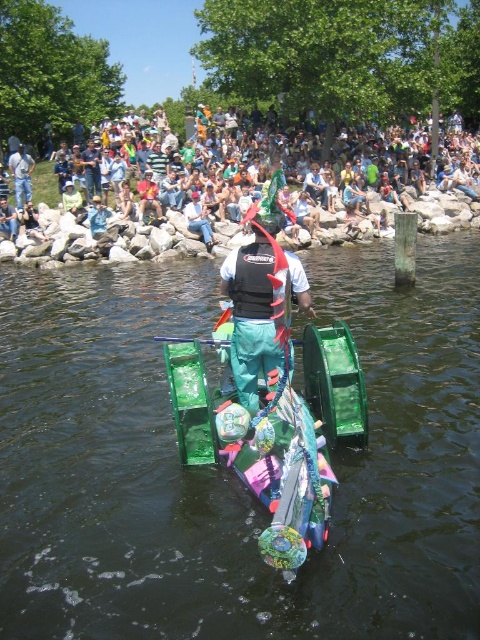
You are a photographer positioned at the center of the scene. You want to take a photo that includes both the point at coordinates point (312, 492) and point (26, 211). Which point should you focus on first to ensure both are in sharp focus?

To ensure both points are in sharp focus, you should focus on point (312, 492) first because it is closer to the viewer than point (26, 211). This way, the depth of field will cover both points more effectively.

You are a photographer trying to capture a photo of the shiny green plastic boat at center and the light blue fabric shirt at center. Which object should you focus on first if you want to ensure both are in the frame without moving the camera?

You should focus on the shiny green plastic boat at center first because it is positioned below the light blue fabric shirt at center, so adjusting focus starting from the lower object ensures both are in the frame.